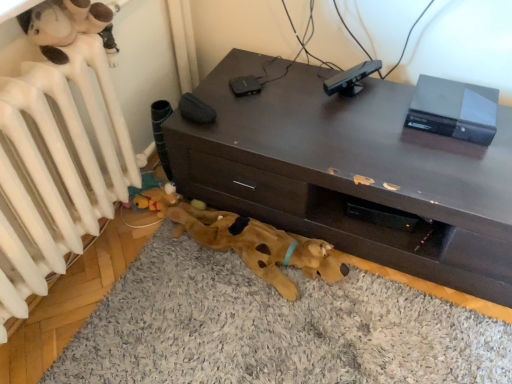
Where is `free space above dark brown wood desk at center (from a real-world perspective)`? free space above dark brown wood desk at center (from a real-world perspective) is located at coordinates (359, 120).